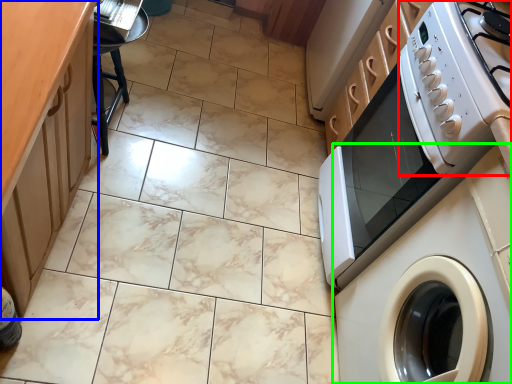
Question: Which is farther away from gas stove (highlighted by a red box)? counter top (highlighted by a blue box) or washing machine (highlighted by a green box)?

Choices:
 (A) counter top
 (B) washing machine

Answer: (A)